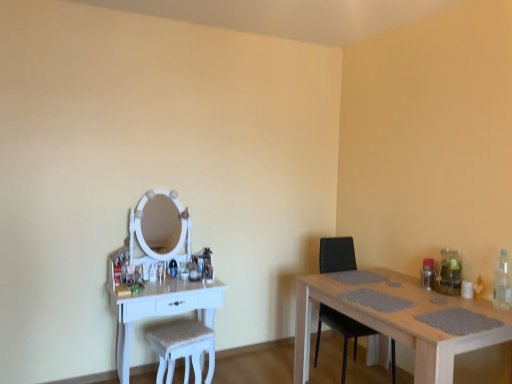
Identify the location of free location to the left of clear plastic bottle at right. The width and height of the screenshot is (512, 384). (481, 307).